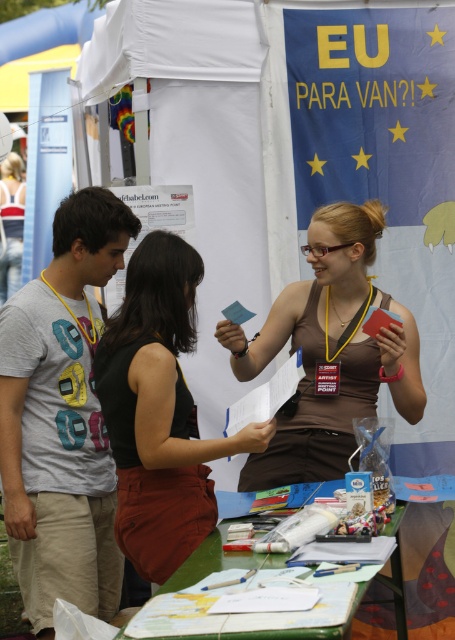
Question: Among these points, which one is farthest from the camera?

Choices:
 (A) (13, 195)
 (B) (216, 636)
 (C) (314, 371)
 (D) (170, 500)

Answer: (A)

Question: Is brown matte tank top at center bigger than green painted wood table at lower center?

Choices:
 (A) yes
 (B) no

Answer: (A)

Question: Which point is closer to the camera?

Choices:
 (A) pyautogui.click(x=390, y=364)
 (B) pyautogui.click(x=24, y=392)

Answer: (B)

Question: Does black cotton tank top at center have a greater width compared to matte black tank top at center?

Choices:
 (A) no
 (B) yes

Answer: (B)

Question: Is green painted wood table at lower center to the right of matte black tank top at center from the viewer's perspective?

Choices:
 (A) no
 (B) yes

Answer: (B)

Question: Which point appears closest to the camera in this image?

Choices:
 (A) (120, 369)
 (B) (274, 632)
 (C) (20, 216)

Answer: (B)